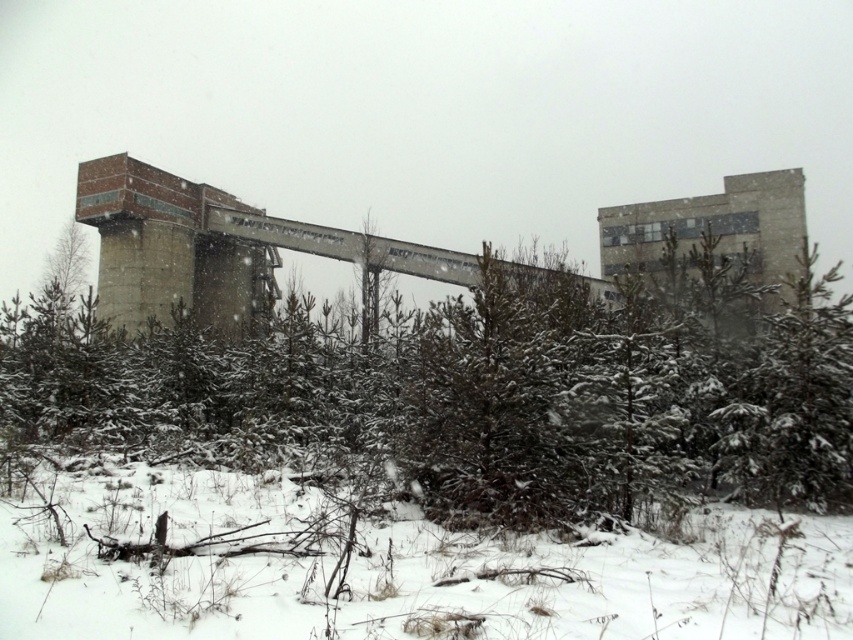
You are standing in the snowy landscape and want to place a small red flag exactly at the coordinates mentioned in the image. Where should you place the flag relative to the white fluffy snow at lower center?

The white fluffy snow at lower center is located at point (407, 573), so you should place the flag exactly at those coordinates where the white fluffy snow at lower center is situated.